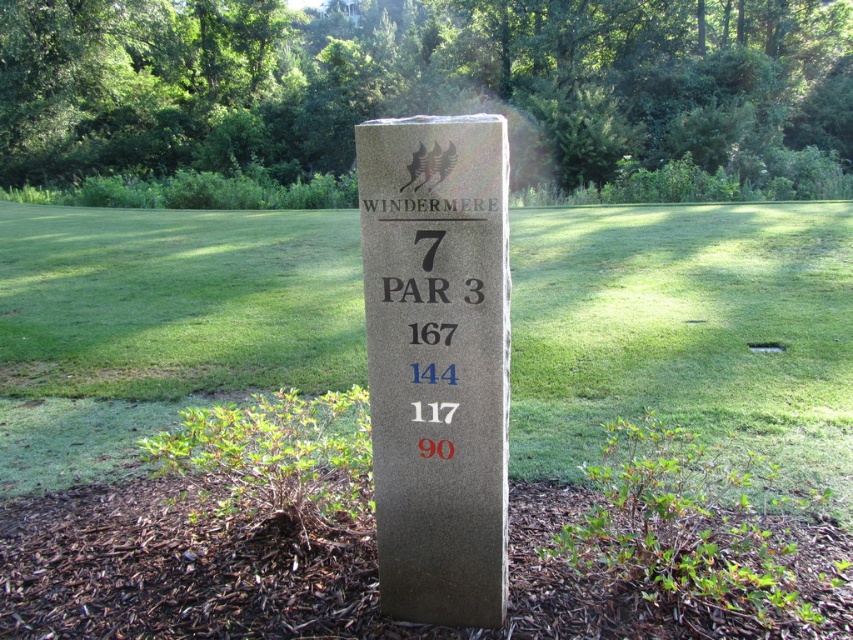
Is point (299, 324) farther from camera compared to point (53, 166)?

That is False.

The height and width of the screenshot is (640, 853). Find the location of `green grass at center`. green grass at center is located at coordinates (683, 330).

Where is `green grass at center`? The image size is (853, 640). green grass at center is located at coordinates (683, 330).

Between green grass at center and granite signpost at center, which one has less height?

Standing shorter between the two is granite signpost at center.

Between green grass at center and granite signpost at center, which one is positioned higher?

green grass at center

Measure the distance between point (323, 216) and camera.

Point (323, 216) is 18.00 meters away from camera.

Identify the location of green grass at center. (683, 330).

Is point (659, 164) behind point (397, 349)?

Yes, point (659, 164) is behind point (397, 349).

What do you see at coordinates (428, 92) in the screenshot?
I see `green leafy tree at upper center` at bounding box center [428, 92].

Does point (347, 170) lie behind point (445, 518)?

Yes, point (347, 170) is farther from viewer.

This screenshot has height=640, width=853. Identify the location of green leafy tree at upper center. (428, 92).